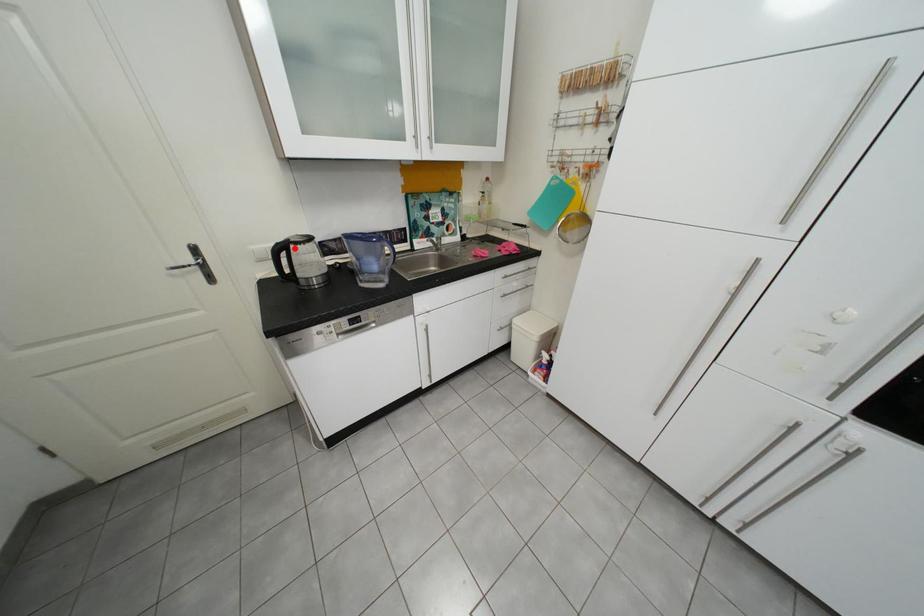
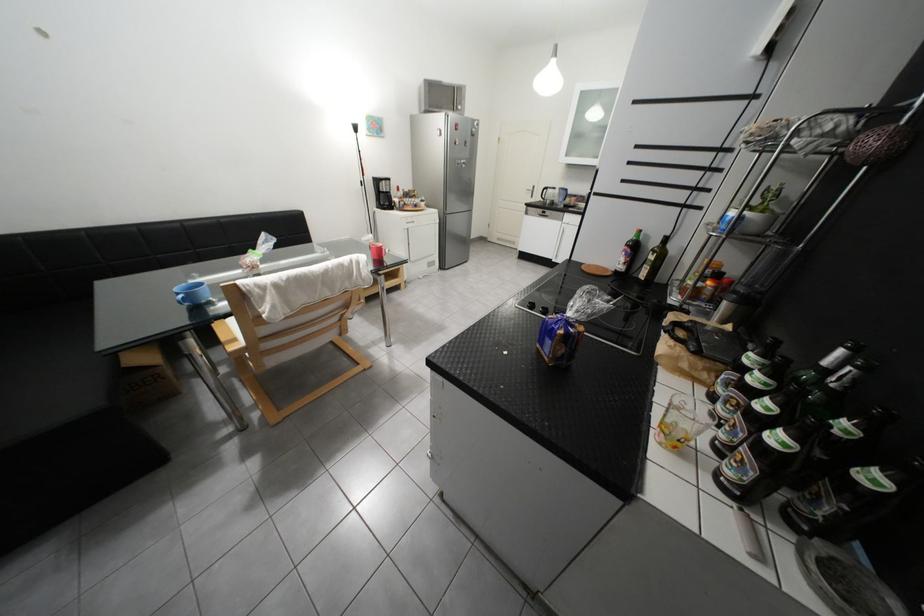
Question: I am providing you with two images of the same scene from different viewpoints. Given a red point in image1, look at the same physical point in image2. Is it:

Choices:
 (A) Closer to the viewpoint
 (B) Farther from the viewpoint

Answer: (A)